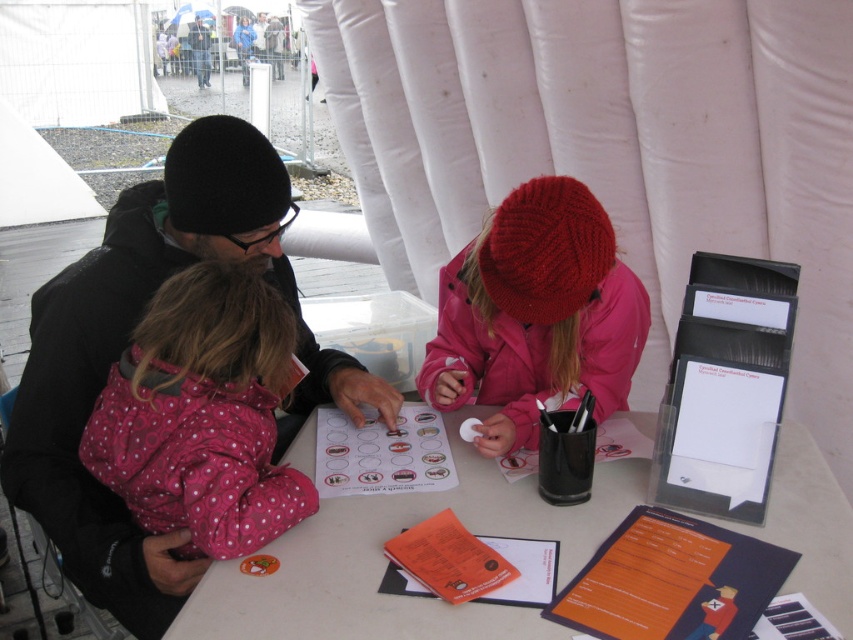
Is pink polka dot jacket at left closer to the viewer compared to matte black jacket at upper left?

Yes, it is in front of matte black jacket at upper left.

The image size is (853, 640). I want to click on pink polka dot jacket at left, so click(x=202, y=413).

The height and width of the screenshot is (640, 853). Find the location of `pink polka dot jacket at left`. pink polka dot jacket at left is located at coordinates (202, 413).

Which of these two, black knit hat at upper left or matte black jacket at upper left, stands shorter?

black knit hat at upper left

Is black knit hat at upper left taller than matte black jacket at upper left?

No.

Measure the distance between point (x=32, y=428) and camera.

They are 4.50 feet apart.

Locate an element on the screen. The image size is (853, 640). black knit hat at upper left is located at coordinates (126, 344).

Can you confirm if pink polka dot jacket at left is wider than knitted woolen hat at center?

In fact, pink polka dot jacket at left might be narrower than knitted woolen hat at center.

Can you confirm if pink polka dot jacket at left is smaller than knitted woolen hat at center?

Correct, pink polka dot jacket at left occupies less space than knitted woolen hat at center.

Is point (267, 362) positioned behind point (471, 289)?

No, (267, 362) is in front of (471, 289).

Identify the location of pink polka dot jacket at left. Image resolution: width=853 pixels, height=640 pixels. (202, 413).